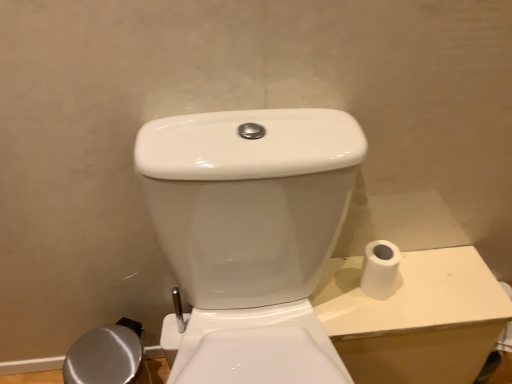
Question: Is white matte toilet paper at right situated inside white glossy porcelain at right or outside?

Choices:
 (A) inside
 (B) outside

Answer: (B)

Question: Is point (371, 248) closer or farther from the camera than point (336, 306)?

Choices:
 (A) farther
 (B) closer

Answer: (A)

Question: In the image, is white matte toilet paper at right on the left side or the right side of white glossy porcelain at right?

Choices:
 (A) right
 (B) left

Answer: (B)

Question: Considering the positions of white glossy porcelain at right and white matte toilet paper at right in the image, is white glossy porcelain at right taller or shorter than white matte toilet paper at right?

Choices:
 (A) tall
 (B) short

Answer: (A)

Question: From the image's perspective, is white glossy porcelain at right positioned above or below white matte toilet paper at right?

Choices:
 (A) below
 (B) above

Answer: (A)

Question: Looking at their shapes, would you say white glossy porcelain at right is wider or thinner than white matte toilet paper at right?

Choices:
 (A) wide
 (B) thin

Answer: (A)

Question: Based on their sizes in the image, would you say white glossy porcelain at right is bigger or smaller than white matte toilet paper at right?

Choices:
 (A) small
 (B) big

Answer: (B)